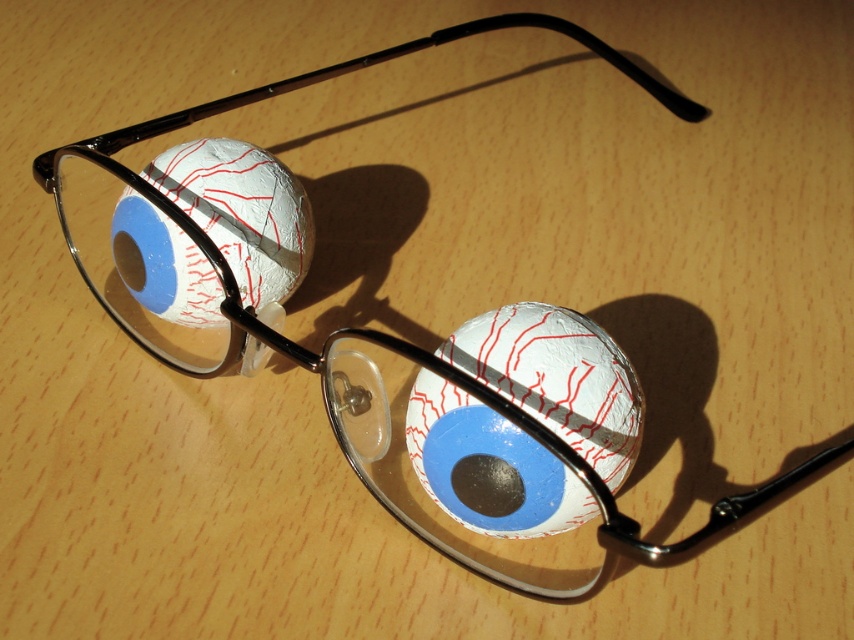
Based on the photo, which is more to the right, white crinkled paper eyeball at center or white crinkled baseball at left?

white crinkled paper eyeball at center

Does white crinkled paper eyeball at center come in front of white crinkled baseball at left?

Yes, white crinkled paper eyeball at center is in front of white crinkled baseball at left.

This screenshot has width=854, height=640. I want to click on white crinkled paper eyeball at center, so click(557, 378).